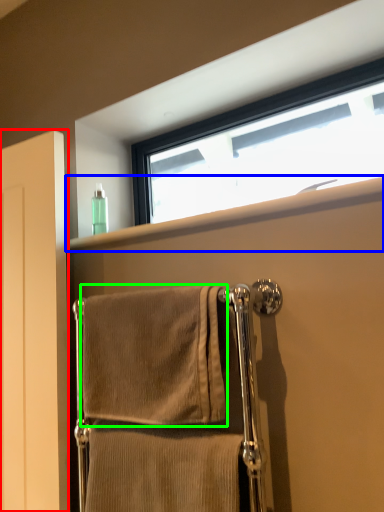
Question: Which object is positioned closest to screen door (highlighted by a red box)? Select from window sill (highlighted by a blue box) and towel (highlighted by a green box).

Choices:
 (A) window sill
 (B) towel

Answer: (B)